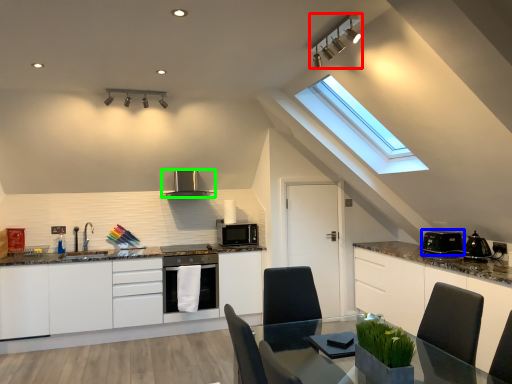
Question: Based on their relative distances, which object is nearer to light fixture (highlighted by a red box)? Choose from appliance (highlighted by a blue box) and kitchen appliance (highlighted by a green box).

Choices:
 (A) appliance
 (B) kitchen appliance

Answer: (A)